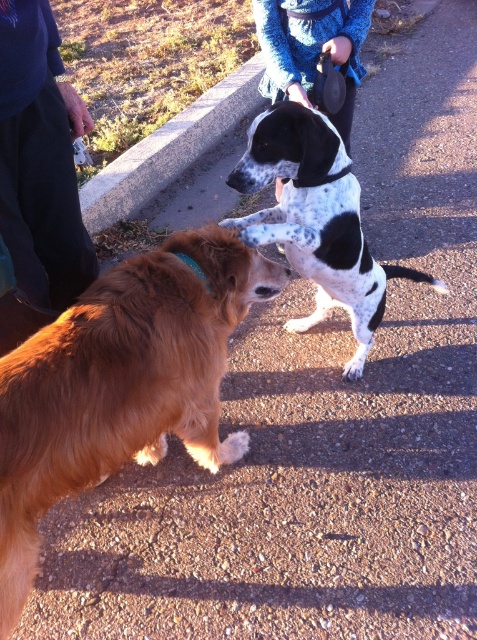
You are a photographer trying to capture the golden brown fur at center in the image. Based on its coordinates, where should you aim your camera to ensure it is centered in the frame?

The golden brown fur at center is located at coordinates point (121, 384). To center it in the frame, aim your camera at that exact coordinate point.